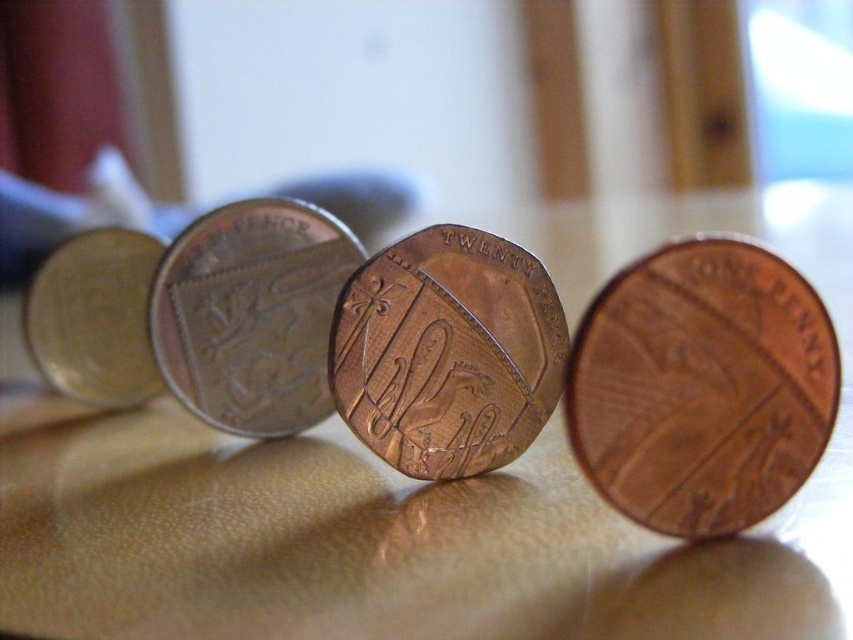
Question: Based on their relative distances, which object is farther from the bronze/copper coin at center?

Choices:
 (A) gold plated coin at left
 (B) copper-bronze coin at center
 (C) shiny brown table at center

Answer: (C)

Question: Observing the image, what is the correct spatial positioning of shiny brown table at center in reference to gold plated coin at left?

Choices:
 (A) below
 (B) above

Answer: (B)

Question: Is copper/brass penny at right thinner than bronze/copper coin at center?

Choices:
 (A) no
 (B) yes

Answer: (A)

Question: Among these points, which one is nearest to the camera?

Choices:
 (A) pyautogui.click(x=184, y=497)
 (B) pyautogui.click(x=73, y=364)
 (C) pyautogui.click(x=762, y=360)

Answer: (C)

Question: Which object is closer to the camera taking this photo?

Choices:
 (A) copper/brass penny at right
 (B) bronze/copper coin at center
 (C) copper-bronze coin at center

Answer: (A)

Question: Is shiny brown table at center wider than copper/brass penny at right?

Choices:
 (A) yes
 (B) no

Answer: (A)